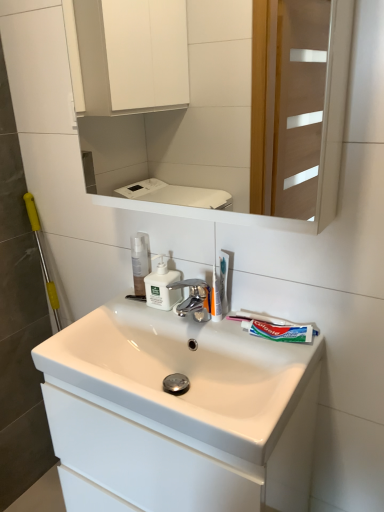
Where is `vacant region to the left of white matte soap dispenser at center`? vacant region to the left of white matte soap dispenser at center is located at coordinates (121, 310).